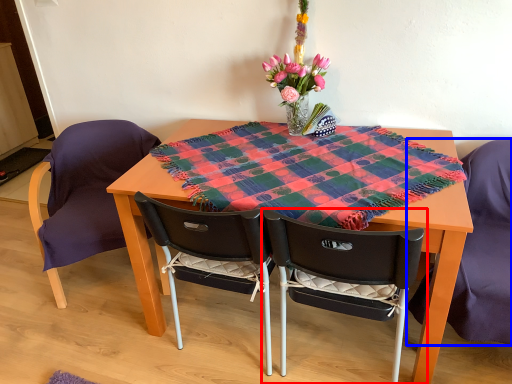
Question: Which of the following is the closest to the observer, chair (highlighted by a red box) or chair (highlighted by a blue box)?

Choices:
 (A) chair
 (B) chair

Answer: (A)